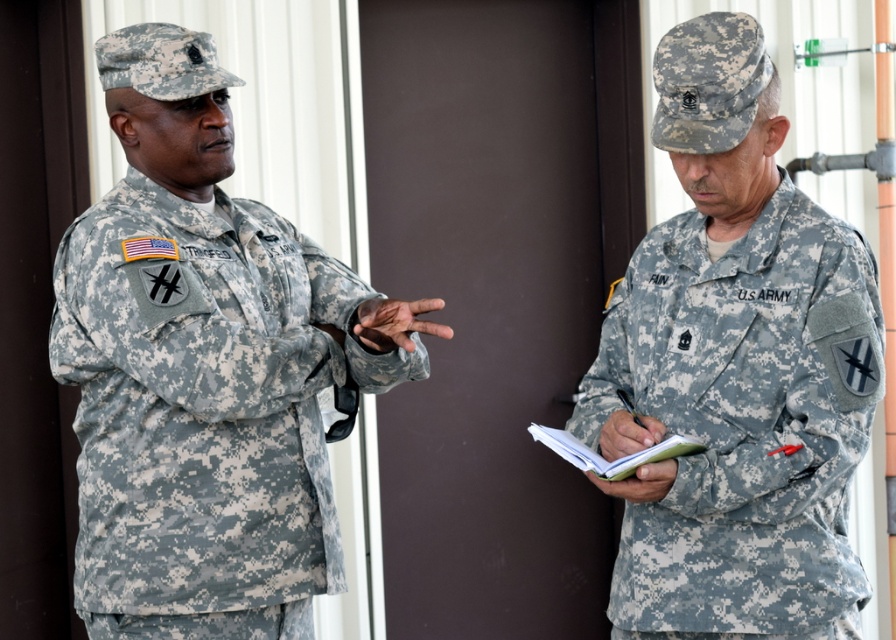
You are a tailor who needs to adjust the camouflage fabric uniform at left and the camouflage fabric us army uniform at right. Which uniform requires more fabric to alter due to its size?

The camouflage fabric uniform at left requires more fabric for alterations because it has a larger size compared to the camouflage fabric us army uniform at right.

You are a photographer positioned in front of the door with dark brown finish. You need to take a photo that includes both the camouflage fabric uniform at left and the camouflage fabric us army uniform at right. Which uniform should you focus on first to ensure both are in frame?

You should focus on the camouflage fabric uniform at left first because it is closer to you than the camouflage fabric us army uniform at right, so adjusting the camera to include it ensures the farther one is also in frame.

You are a drone operator trying to determine the distance between two points in the scene. The first point is point (269, 314) and the second point is point (828, 556). Based on their positions relative to the camera, which point is closer to you?

Point (828, 556) is closer to the camera than point (269, 314) because the description states that point (269, 314) is further away.